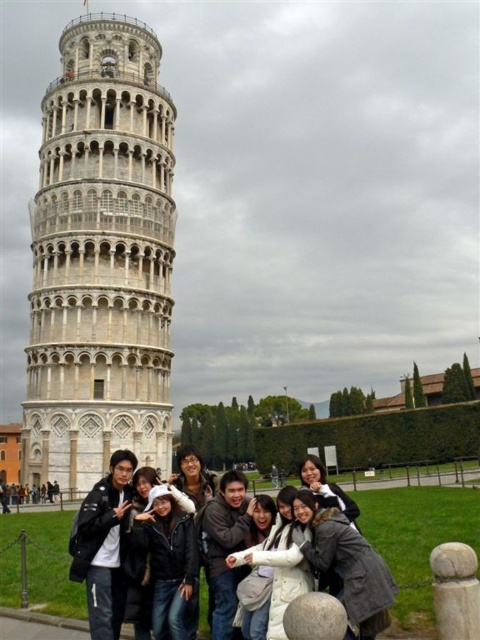
Question: Observing the image, what is the correct spatial positioning of white fur-trimmed hat at center in reference to white fleece jacket at center?

Choices:
 (A) left
 (B) right

Answer: (A)

Question: Which is farther from the white marble tower at center?

Choices:
 (A) black leather jacket at center
 (B) gray wool coat at center
 (C) white fleece jacket at center

Answer: (B)

Question: Does black leather jacket at center come in front of white fur-trimmed hat at center?

Choices:
 (A) no
 (B) yes

Answer: (A)

Question: Observing the image, what is the correct spatial positioning of white marble tower at center in reference to gray wool coat at center?

Choices:
 (A) right
 (B) left

Answer: (B)

Question: Which object appears closest to the camera in this image?

Choices:
 (A) white fleece jacket at center
 (B) white fur-trimmed hat at center

Answer: (A)

Question: Based on their relative distances, which object is nearer to the white fleece jacket at center?

Choices:
 (A) gray wool coat at center
 (B) white fur-trimmed hat at center
 (C) black leather jacket at center

Answer: (B)